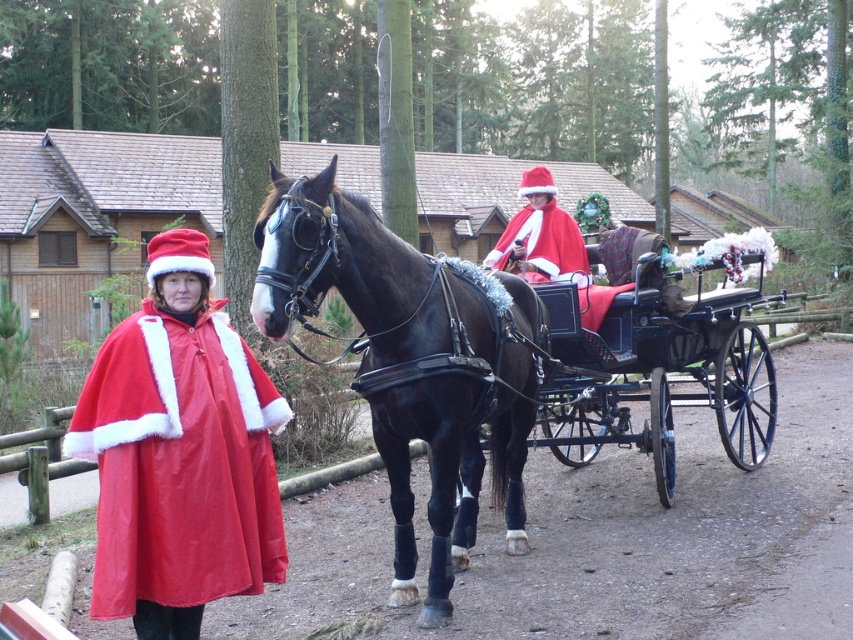
Is shiny red cape at left to the right of velvet red cape at center from the viewer's perspective?

Incorrect, shiny red cape at left is not on the right side of velvet red cape at center.

This screenshot has width=853, height=640. I want to click on shiny red cape at left, so click(178, 452).

Where is `shiny red cape at left`? shiny red cape at left is located at coordinates (178, 452).

Does shiny black horse at center appear over velvet red cape at center?

No.

Describe the element at coordinates (412, 360) in the screenshot. I see `shiny black horse at center` at that location.

Is point (444, 468) farther from camera compared to point (523, 179)?

No.

Where is `shiny black horse at center`? The height and width of the screenshot is (640, 853). shiny black horse at center is located at coordinates (412, 360).

Is black polished wood cart at center further to the viewer compared to velvet red cape at center?

No, it is not.

Does black polished wood cart at center appear on the left side of velvet red cape at center?

No, black polished wood cart at center is not to the left of velvet red cape at center.

I want to click on black polished wood cart at center, so click(x=654, y=374).

Identify the location of black polished wood cart at center. The image size is (853, 640). (654, 374).